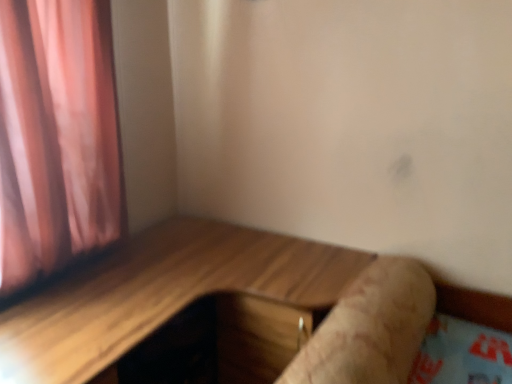
Question: Can you confirm if brown textured log at lower right is smaller than wooden table at center?

Choices:
 (A) yes
 (B) no

Answer: (A)

Question: Does brown textured log at lower right have a lesser width compared to wooden table at center?

Choices:
 (A) yes
 (B) no

Answer: (A)

Question: Is brown textured log at lower right aimed at wooden table at center?

Choices:
 (A) no
 (B) yes

Answer: (A)

Question: From the image's perspective, does brown textured log at lower right appear higher than wooden table at center?

Choices:
 (A) no
 (B) yes

Answer: (B)

Question: Considering the relative positions of brown textured log at lower right and wooden table at center in the image provided, is brown textured log at lower right in front of wooden table at center?

Choices:
 (A) yes
 (B) no

Answer: (B)

Question: Considering the relative sizes of brown textured log at lower right and wooden table at center in the image provided, is brown textured log at lower right bigger than wooden table at center?

Choices:
 (A) no
 (B) yes

Answer: (A)

Question: From the image's perspective, is wooden table at center above brown textured log at lower right?

Choices:
 (A) no
 (B) yes

Answer: (A)

Question: Does wooden table at center have a larger size compared to brown textured log at lower right?

Choices:
 (A) yes
 (B) no

Answer: (A)

Question: Is wooden table at center positioned before brown textured log at lower right?

Choices:
 (A) no
 (B) yes

Answer: (B)

Question: Would you say brown textured log at lower right is part of wooden table at center's contents?

Choices:
 (A) no
 (B) yes

Answer: (A)

Question: Can you confirm if wooden table at center is thinner than brown textured log at lower right?

Choices:
 (A) yes
 (B) no

Answer: (B)

Question: From a real-world perspective, is wooden table at center over brown textured log at lower right?

Choices:
 (A) yes
 (B) no

Answer: (B)

Question: Relative to brown textured log at lower right, is wooden table at center in front or behind?

Choices:
 (A) behind
 (B) front

Answer: (B)